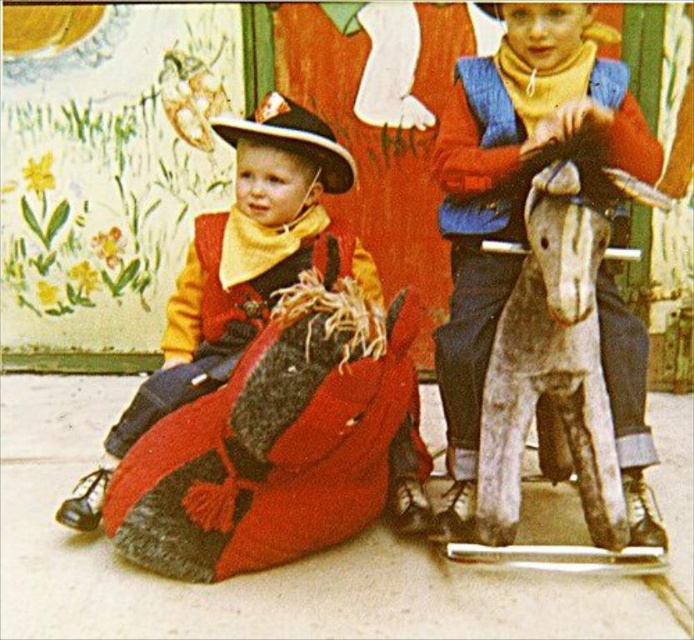
Question: Based on their relative distances, which object is nearer to the matte brown cowboy hat at center?

Choices:
 (A) fuzzy red blanket at lower left
 (B) wooden rocking horse at center

Answer: (A)

Question: Which point appears farthest from the camera in this image?

Choices:
 (A) (137, 404)
 (B) (645, 166)

Answer: (A)

Question: Which of the following is the farthest from the observer?

Choices:
 (A) matte brown cowboy hat at center
 (B) wooden rocking horse at center

Answer: (A)

Question: Does wooden rocking horse at center appear on the right side of fuzzy red blanket at lower left?

Choices:
 (A) yes
 (B) no

Answer: (A)

Question: From the image, what is the correct spatial relationship of wooden rocking horse at center in relation to fuzzy red blanket at lower left?

Choices:
 (A) below
 (B) above

Answer: (B)

Question: Does fuzzy red blanket at lower left come behind matte brown cowboy hat at center?

Choices:
 (A) yes
 (B) no

Answer: (B)